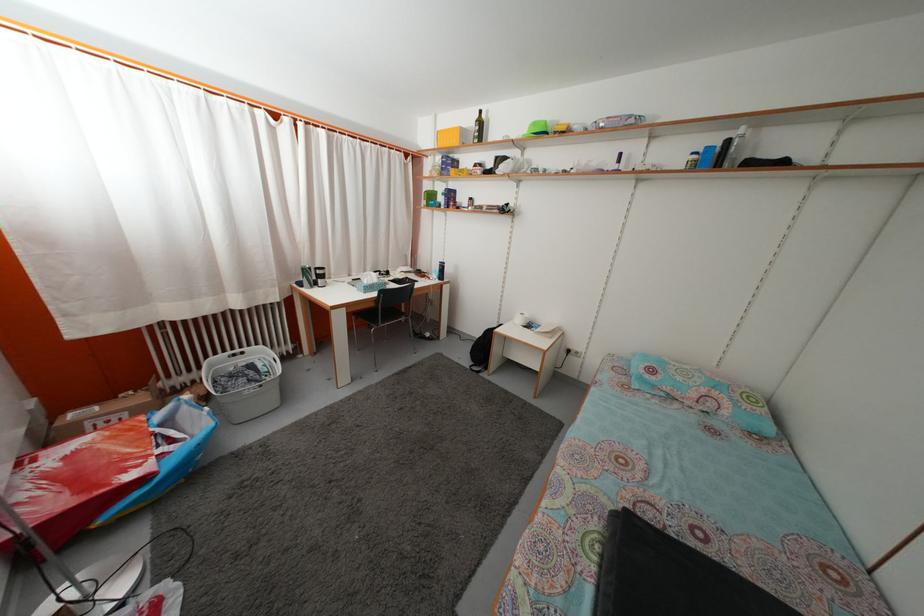
Where is `green glass bottle`? Image resolution: width=924 pixels, height=616 pixels. green glass bottle is located at coordinates (478, 128).